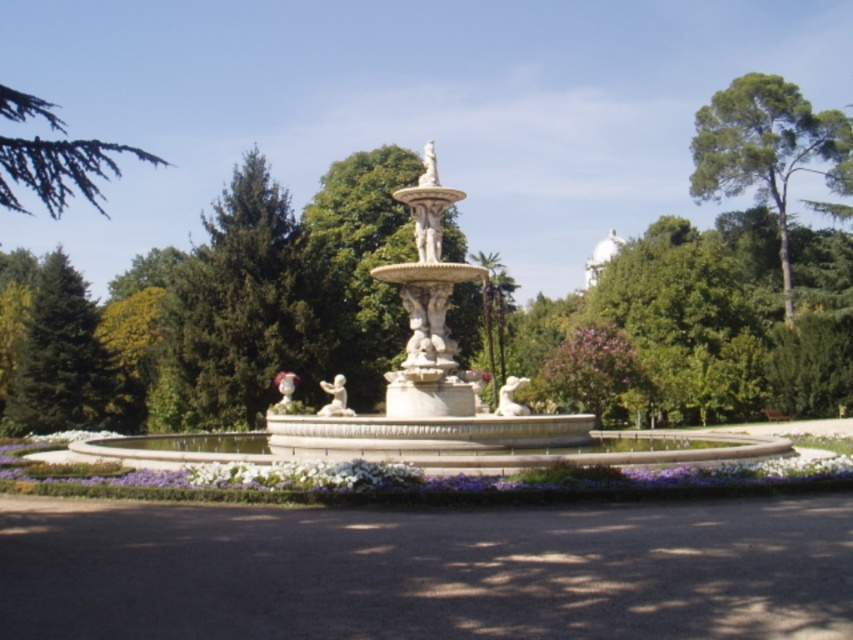
Is point (308, 424) positioned in front of point (265, 244)?

Yes, point (308, 424) is in front of point (265, 244).

Is white stone fountain at center thinner than green textured tree at upper left?

Incorrect, white stone fountain at center's width is not less than green textured tree at upper left's.

The height and width of the screenshot is (640, 853). What are the coordinates of `white stone fountain at center` in the screenshot? It's located at (438, 396).

Locate an element on the screen. white stone fountain at center is located at coordinates (438, 396).

Which is behind, point (228, 316) or point (41, 413)?

The point (41, 413) is behind.

Can you confirm if green textured tree at upper left is thinner than green fir tree at left?

No, green textured tree at upper left is not thinner than green fir tree at left.

Who is more forward, (213,236) or (33,300)?

Point (213,236) is more forward.

Find the location of a particular element. green textured tree at upper left is located at coordinates (238, 308).

Can you confirm if white stone fountain at center is positioned below green leafy tree at upper right?

Yes.

Which is in front, point (305, 449) or point (770, 102)?

Point (305, 449) is more forward.

Image resolution: width=853 pixels, height=640 pixels. What do you see at coordinates (438, 396) in the screenshot? I see `white stone fountain at center` at bounding box center [438, 396].

This screenshot has height=640, width=853. Find the location of `white stone fountain at center`. white stone fountain at center is located at coordinates (438, 396).